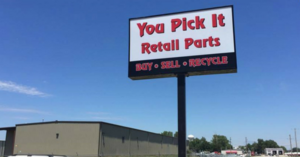
I want to click on black metal pole, so click(183, 90).